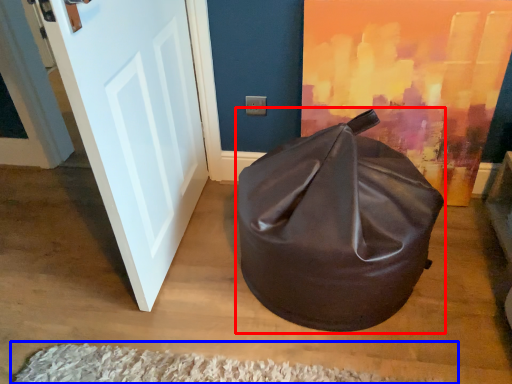
Question: Among these objects, which one is farthest to the camera, bean bag chair (highlighted by a red box) or doormat (highlighted by a blue box)?

Choices:
 (A) bean bag chair
 (B) doormat

Answer: (B)